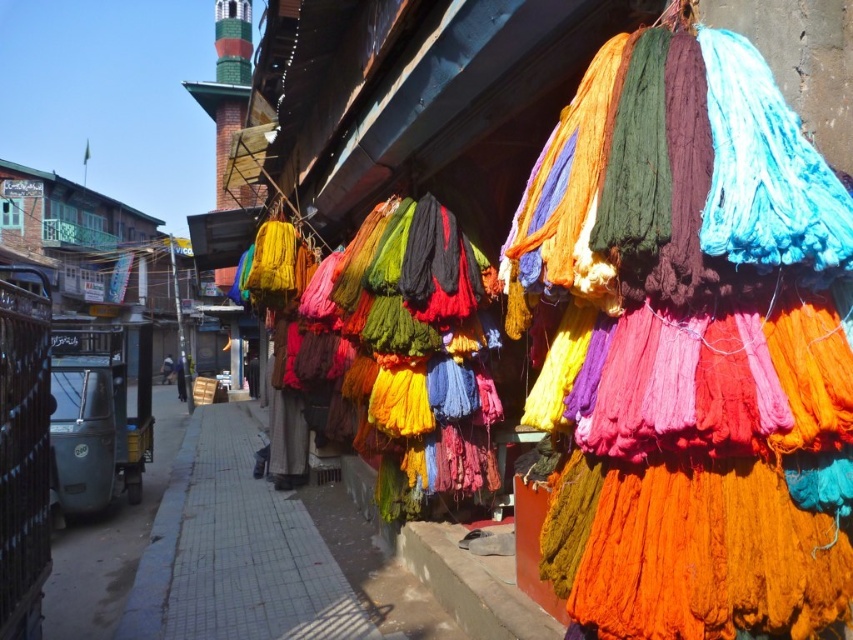
You are standing on the gray concrete pavement at lower left and want to pick up a piece of bright multicolored yarn at right. Can you reach it without moving from your current position?

The bright multicolored yarn at right is located above the gray concrete pavement at lower left, so you cannot reach it without moving from your current position because it is higher up.

You are a delivery person carrying a large package and need to navigate through the street scene shown. The bright multicolored yarn at right and the gray concrete pavement at lower left are in your path. Which area should you choose to avoid obstacles and ensure safe passage?

The gray concrete pavement at lower left is larger and provides a safer path compared to the bright multicolored yarn at right, which is smaller and may obstruct movement.